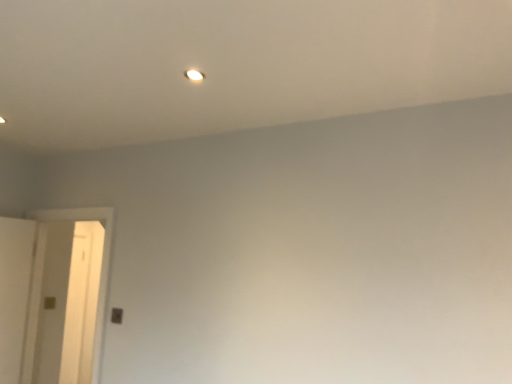
Question: Can you confirm if white matte door at left is taller than white glossy light at upper center?

Choices:
 (A) no
 (B) yes

Answer: (B)

Question: From a real-world perspective, does white matte door at left stand above white glossy light at upper center?

Choices:
 (A) no
 (B) yes

Answer: (A)

Question: From a real-world perspective, is white matte door at left under white glossy light at upper center?

Choices:
 (A) no
 (B) yes

Answer: (B)

Question: Is white matte door at left at the left side of white glossy light at upper center?

Choices:
 (A) no
 (B) yes

Answer: (B)

Question: Can you confirm if white matte door at left is positioned to the right of white glossy light at upper center?

Choices:
 (A) no
 (B) yes

Answer: (A)

Question: Is white matte door at left looking in the opposite direction of white glossy light at upper center?

Choices:
 (A) no
 (B) yes

Answer: (A)

Question: Is white glossy light at upper center aimed at white matte door at left?

Choices:
 (A) yes
 (B) no

Answer: (B)

Question: Considering the relative sizes of white glossy light at upper center and white matte door at left in the image provided, is white glossy light at upper center shorter than white matte door at left?

Choices:
 (A) no
 (B) yes

Answer: (B)

Question: Is white glossy light at upper center smaller than white matte door at left?

Choices:
 (A) yes
 (B) no

Answer: (A)

Question: Does white glossy light at upper center appear on the right side of white matte door at left?

Choices:
 (A) yes
 (B) no

Answer: (A)

Question: From the image's perspective, is white glossy light at upper center beneath white matte door at left?

Choices:
 (A) no
 (B) yes

Answer: (A)

Question: Is white glossy light at upper center outside of white matte door at left?

Choices:
 (A) yes
 (B) no

Answer: (A)

Question: Considering the positions of white matte door at left and white glossy light at upper center in the image, is white matte door at left wider or thinner than white glossy light at upper center?

Choices:
 (A) thin
 (B) wide

Answer: (B)